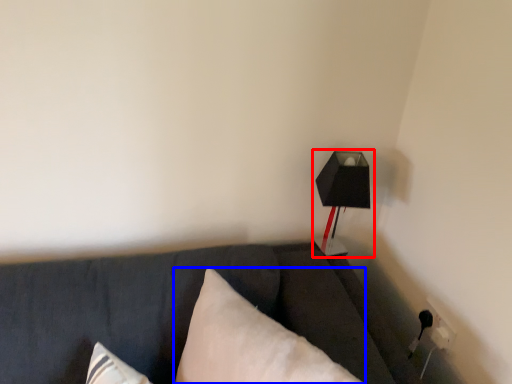
Question: Among these objects, which one is nearest to the camera, lamp (highlighted by a red box) or pillow (highlighted by a blue box)?

Choices:
 (A) lamp
 (B) pillow

Answer: (B)